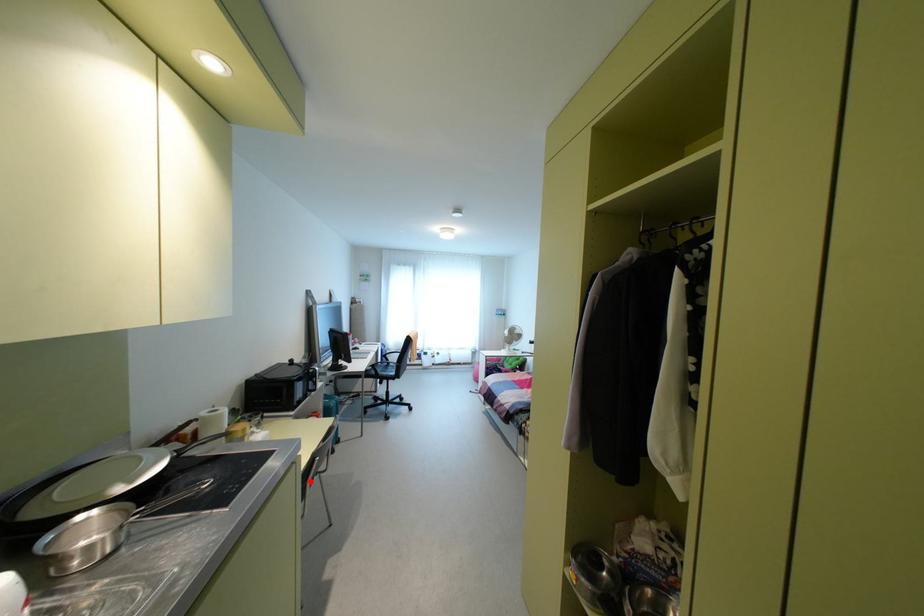
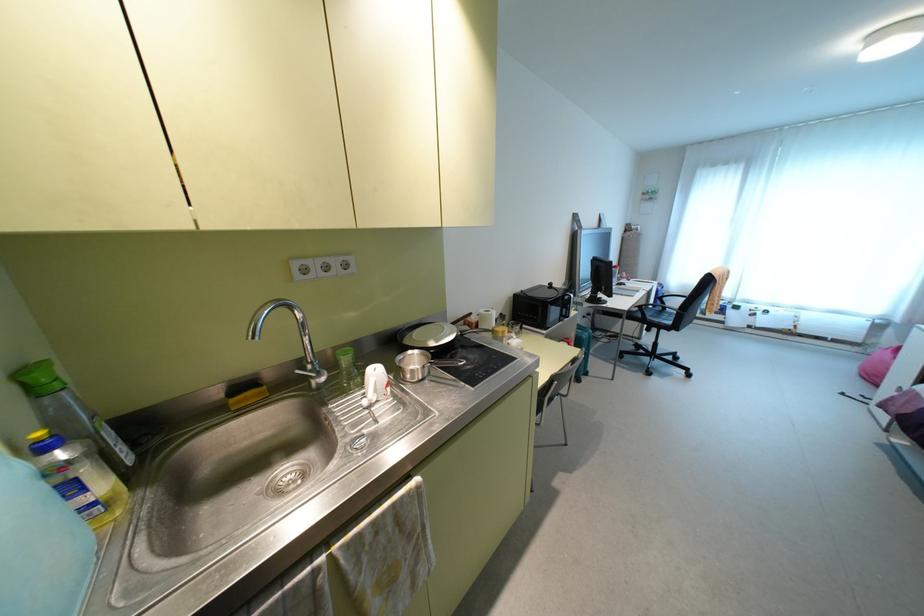
Find the pixel in the second image that matches the highlighted location in the first image.

(551, 399)